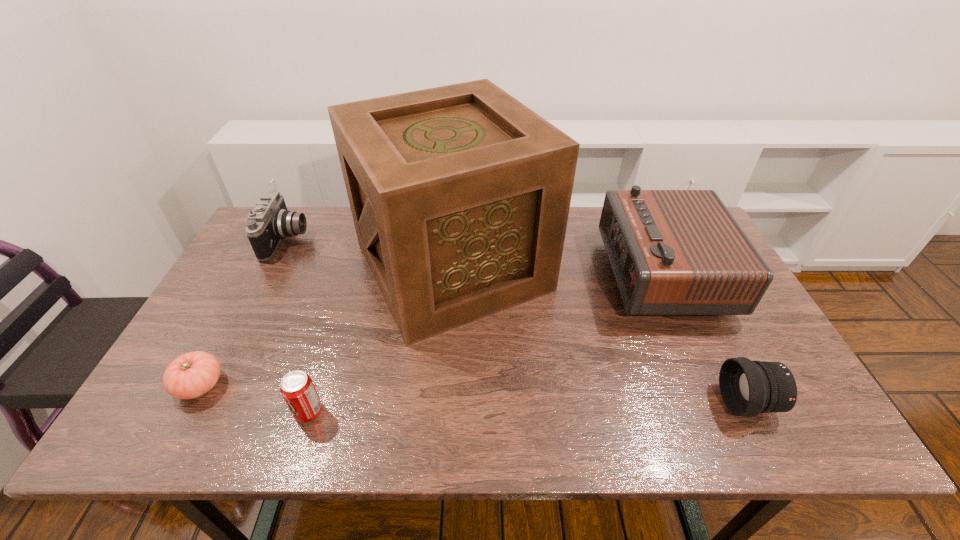
You are a GUI agent. You are given a task and a screenshot of the screen. Output one action in this format:
    pyautogui.click(x=<x>, y=<y>)
    Task: Click on the soda that is at the near edge
    The image size is (960, 540).
    Given the screenshot: What is the action you would take?
    pyautogui.click(x=297, y=388)

Find the location of a particular element. The height and width of the screenshot is (540, 960). tomato at the near edge is located at coordinates (193, 374).

Find the location of a particular element. camera at the left edge is located at coordinates (270, 221).

This screenshot has width=960, height=540. Find the location of `tomato that is at the left edge`. tomato that is at the left edge is located at coordinates (193, 374).

At what (x,y) coordinates should I click in order to perform the action: click on radio receiver that is at the right edge. Please return your answer as a coordinate pair (x, y). The width and height of the screenshot is (960, 540). Looking at the image, I should click on (673, 252).

This screenshot has height=540, width=960. Find the location of `telephoto lens present at the right edge`. telephoto lens present at the right edge is located at coordinates (748, 388).

The width and height of the screenshot is (960, 540). Identify the location of object that is positioned at the far left corner. (270, 221).

At what (x,y) coordinates should I click in order to perform the action: click on object that is positioned at the near left corner. Please return your answer as a coordinate pair (x, y). The height and width of the screenshot is (540, 960). Looking at the image, I should click on (193, 374).

Locate an element on the screen. This screenshot has height=540, width=960. object present at the far right corner is located at coordinates (673, 252).

Locate an element on the screen. This screenshot has width=960, height=540. object that is at the near right corner is located at coordinates (748, 388).